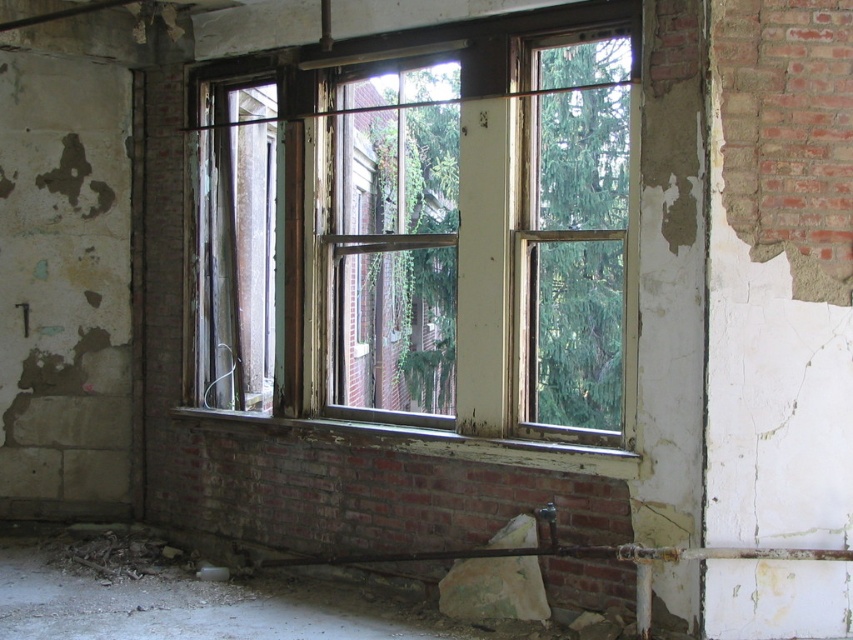
Which of these two, wooden frame window at center or rusty metal chain at lower left, stands shorter?

rusty metal chain at lower left is shorter.

Who is higher up, wooden frame window at center or rusty metal chain at lower left?

wooden frame window at center

Find the location of `wooden frame window at center`. wooden frame window at center is located at coordinates (428, 230).